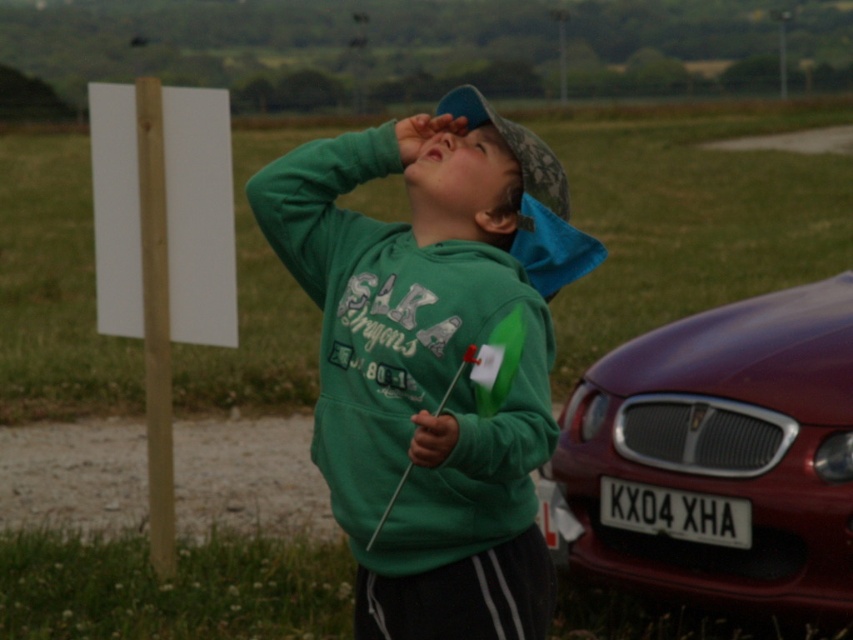
Question: Considering the real-world distances, which object is closest to the light brown wooden pole at left?

Choices:
 (A) blue glossy eye at upper center
 (B) shiny maroon car at lower right
 (C) green cotton hoodie at center

Answer: (B)

Question: Estimate the real-world distances between objects in this image. Which object is farther from the green matte sweatshirt at center?

Choices:
 (A) white plastic license plate at lower right
 (B) light brown wooden pole at left
 (C) blue glossy eye at upper center

Answer: (B)

Question: Does shiny maroon car at lower right appear on the right side of white wooden sign at left?

Choices:
 (A) yes
 (B) no

Answer: (A)

Question: In this image, where is green matte sweatshirt at center located relative to white wooden sign at left?

Choices:
 (A) right
 (B) left

Answer: (A)

Question: Can you confirm if white wooden sign at left is positioned to the left of light brown wooden pole at left?

Choices:
 (A) no
 (B) yes

Answer: (A)

Question: Which point is farther to the camera?

Choices:
 (A) (553, 500)
 (B) (479, 134)

Answer: (A)